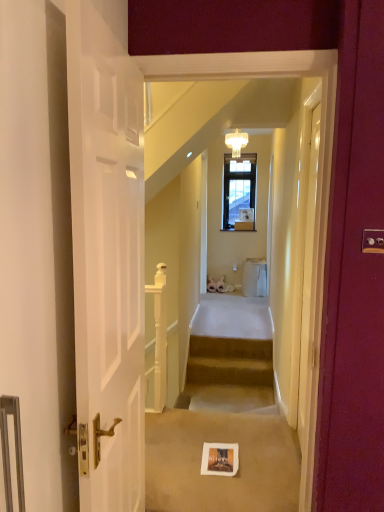
Question: Can you confirm if white matte door at left, the second door viewed from the back, is taller than white glossy door at upper center, placed as the second door when sorted from front to back?

Choices:
 (A) no
 (B) yes

Answer: (B)

Question: Is white matte door at left, the second door viewed from the back, far away from white glossy door at upper center, the first door when ordered from back to front?

Choices:
 (A) yes
 (B) no

Answer: (B)

Question: Does white matte door at left, which is counted as the 1th door, starting from the left, have a lesser height compared to white glossy door at upper center, the first door when ordered from back to front?

Choices:
 (A) no
 (B) yes

Answer: (A)

Question: From the image's perspective, is white matte door at left, the second door viewed from the back, on top of white glossy door at upper center, the first door when ordered from back to front?

Choices:
 (A) no
 (B) yes

Answer: (B)

Question: Does white matte door at left, the 1th door viewed from the front, have a smaller size compared to white glossy door at upper center, placed as the second door when sorted from front to back?

Choices:
 (A) no
 (B) yes

Answer: (A)

Question: From their relative heights in the image, would you say white glossy door at upper center, placed as the second door when sorted from front to back, is taller or shorter than beige carpeted stairs at center?

Choices:
 (A) short
 (B) tall

Answer: (B)

Question: In the image, is white glossy door at upper center, placed as the second door when sorted from front to back, on the left side or the right side of beige carpeted stairs at center?

Choices:
 (A) right
 (B) left

Answer: (A)

Question: From the image's perspective, relative to beige carpeted stairs at center, is white glossy door at upper center, the second door positioned from the left, above or below?

Choices:
 (A) below
 (B) above

Answer: (B)

Question: Looking at their shapes, would you say white glossy door at upper center, the first door when ordered from back to front, is wider or thinner than beige carpeted stairs at center?

Choices:
 (A) thin
 (B) wide

Answer: (A)

Question: Is white matte door at left, acting as the second door starting from the right, taller or shorter than clear glass chandelier at upper center?

Choices:
 (A) tall
 (B) short

Answer: (A)

Question: Considering the positions of white matte door at left, which is counted as the 1th door, starting from the left, and clear glass chandelier at upper center in the image, is white matte door at left, which is counted as the 1th door, starting from the left, wider or thinner than clear glass chandelier at upper center?

Choices:
 (A) wide
 (B) thin

Answer: (B)

Question: From a real-world perspective, is white matte door at left, the 1th door viewed from the front, positioned above or below clear glass chandelier at upper center?

Choices:
 (A) above
 (B) below

Answer: (B)

Question: Is white matte door at left, acting as the second door starting from the right, situated inside clear glass chandelier at upper center or outside?

Choices:
 (A) inside
 (B) outside

Answer: (B)

Question: Considering the positions of clear glass chandelier at upper center and white matte door at left, which is counted as the 1th door, starting from the left, in the image, is clear glass chandelier at upper center wider or thinner than white matte door at left, which is counted as the 1th door, starting from the left,?

Choices:
 (A) wide
 (B) thin

Answer: (A)

Question: Visually, is clear glass chandelier at upper center positioned to the left or to the right of white matte door at left, the second door viewed from the back?

Choices:
 (A) right
 (B) left

Answer: (A)